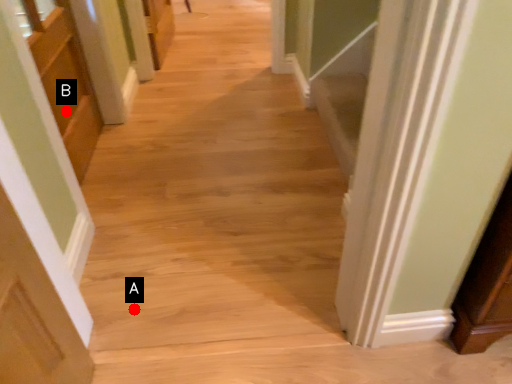
Question: Two points are circled on the image, labeled by A and B beside each circle. Which point appears farthest from the camera in this image?

Choices:
 (A) A is further
 (B) B is further

Answer: (B)